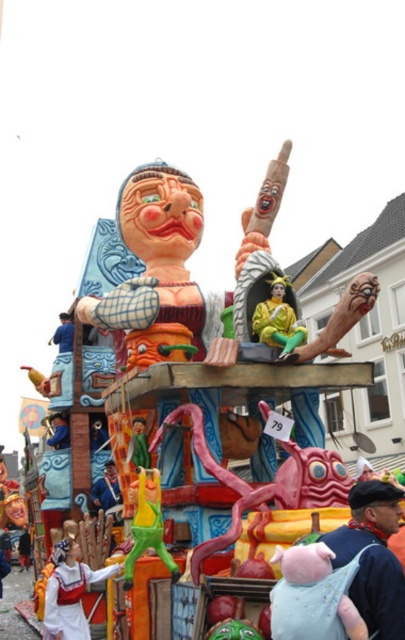
Question: Is green rubber monkey at lower left wider than matte blue helmet at upper left?

Choices:
 (A) no
 (B) yes

Answer: (A)

Question: Among these points, which one is farthest from the camera?

Choices:
 (A) (370, 481)
 (B) (72, 317)

Answer: (B)

Question: Based on their relative distances, which object is farther from the green rubber monkey at lower left?

Choices:
 (A) green rubber frog at center
 (B) light blue fabric at lower right

Answer: (B)

Question: Does light blue fabric at lower right appear on the left side of green rubber monkey at lower left?

Choices:
 (A) no
 (B) yes

Answer: (A)

Question: Can you confirm if green rubber monkey at lower left is wider than matte blue helmet at upper left?

Choices:
 (A) yes
 (B) no

Answer: (B)

Question: Based on their relative distances, which object is nearer to the green rubber monkey at lower left?

Choices:
 (A) green rubber frog at center
 (B) light blue fabric pig at center
 (C) light blue fabric at lower right
 (D) white fabric figure at lower left

Answer: (D)